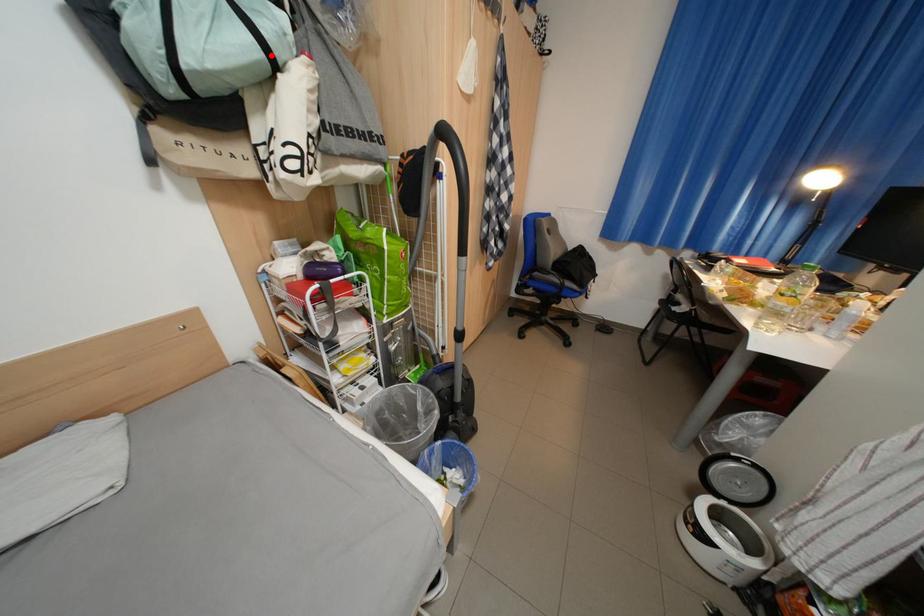
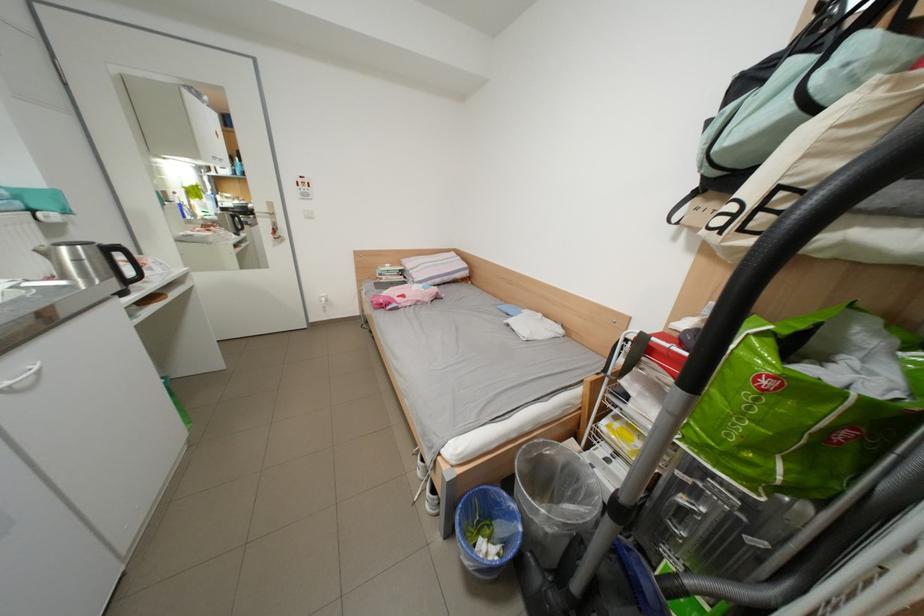
The point at the highlighted location is marked in the first image. Where is the corresponding point in the second image?

(801, 111)